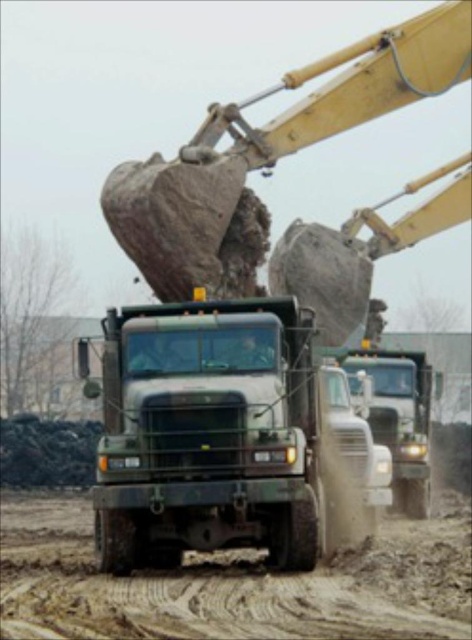
Can you confirm if green matte truck at center is shorter than metallic silver truck at center?

Yes.

Is green matte truck at center below metallic silver truck at center?

Actually, green matte truck at center is above metallic silver truck at center.

Find the location of `green matte truck at center`. green matte truck at center is located at coordinates (209, 433).